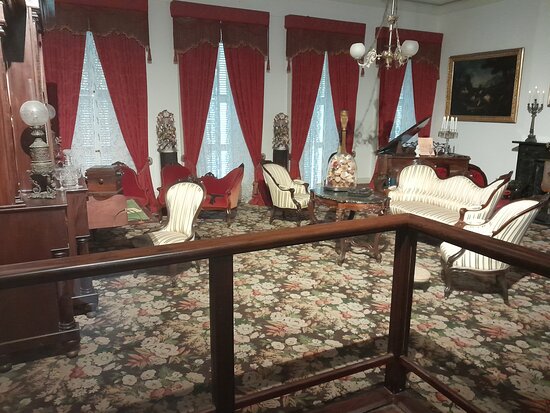
Locate an element on the screen. curtains is located at coordinates (55, 52), (121, 50), (199, 55), (250, 63), (305, 67), (387, 77), (418, 74).